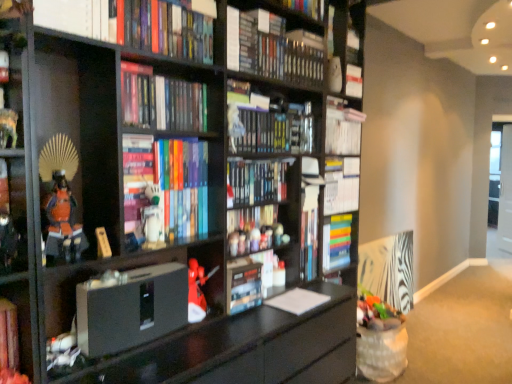
Question: Is hardcover book at center, acting as the fourth book starting from the bottom, taller than matte gray speaker at center, which ranks as the 1th paperback book in left-to-right order?

Choices:
 (A) yes
 (B) no

Answer: (B)

Question: Can you confirm if hardcover book at center, marked as the 6th book in a top-to-bottom arrangement, is smaller than matte gray speaker at center, which ranks as the 1th paperback book in left-to-right order?

Choices:
 (A) no
 (B) yes

Answer: (B)

Question: Is hardcover book at center, acting as the fourth book starting from the bottom, looking in the opposite direction of matte gray speaker at center, the 3th paperback book from the right?

Choices:
 (A) no
 (B) yes

Answer: (A)

Question: Considering the relative sizes of hardcover book at center, acting as the fourth book starting from the bottom, and matte gray speaker at center, which ranks as the 1th paperback book in left-to-right order, in the image provided, is hardcover book at center, acting as the fourth book starting from the bottom, thinner than matte gray speaker at center, which ranks as the 1th paperback book in left-to-right order,?

Choices:
 (A) no
 (B) yes

Answer: (B)

Question: Is hardcover book at center, acting as the fourth book starting from the bottom, to the left of matte gray speaker at center, the 3th paperback book from the right, from the viewer's perspective?

Choices:
 (A) no
 (B) yes

Answer: (A)

Question: In terms of width, does matte plastic toy at center, the 3th toy positioned from the right, look wider or thinner when compared to matte plastic toy at center, the 2th toy when ordered from right to left?

Choices:
 (A) thin
 (B) wide

Answer: (A)

Question: From a real-world perspective, is matte plastic toy at center, placed as the fourth toy when sorted from left to right, physically located above or below matte plastic toy at center, which is the 2th toy in back-to-front order?

Choices:
 (A) above
 (B) below

Answer: (B)

Question: Considering the positions of matte plastic toy at center, the third toy ordered from the bottom, and matte plastic toy at center, which is counted as the second toy, starting from the top, in the image, is matte plastic toy at center, the third toy ordered from the bottom, taller or shorter than matte plastic toy at center, which is counted as the second toy, starting from the top,?

Choices:
 (A) short
 (B) tall

Answer: (B)

Question: Is point (256, 243) closer or farther from the camera than point (264, 228)?

Choices:
 (A) closer
 (B) farther

Answer: (A)

Question: Considering the positions of point (11, 109) and point (89, 342), is point (11, 109) closer or farther from the camera than point (89, 342)?

Choices:
 (A) farther
 (B) closer

Answer: (B)

Question: Is matte black shelf at left, which ranks as the second shelf in bottom-to-top order, in front of or behind matte gray speaker at center, the 3th paperback book from the right, in the image?

Choices:
 (A) behind
 (B) front

Answer: (B)

Question: From a real-world perspective, is matte black shelf at left, which ranks as the second shelf in bottom-to-top order, above or below matte gray speaker at center, the 3th paperback book from the right?

Choices:
 (A) above
 (B) below

Answer: (A)

Question: Is matte black shelf at left, the first shelf in the top-to-bottom sequence, to the left or to the right of matte gray speaker at center, the 3th paperback book from the right, in the image?

Choices:
 (A) right
 (B) left

Answer: (B)

Question: Based on their sizes in the image, would you say multicolored hardcover book at center, which ranks as the second book in bottom-to-top order, is bigger or smaller than matte plastic toy at center, placed as the fourth toy when sorted from left to right?

Choices:
 (A) small
 (B) big

Answer: (B)

Question: Do you think multicolored hardcover book at center, which ranks as the second book in bottom-to-top order, is within matte plastic toy at center, the 3th toy positioned from the right, or outside of it?

Choices:
 (A) outside
 (B) inside

Answer: (A)